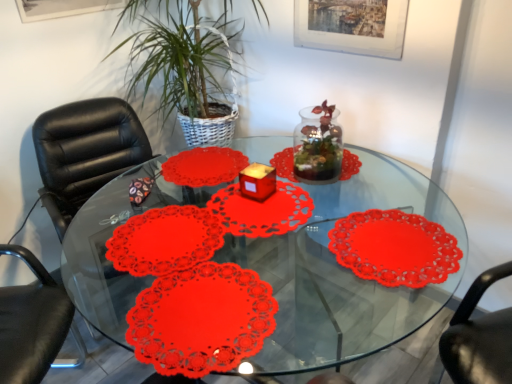
The width and height of the screenshot is (512, 384). What do you see at coordinates (257, 181) in the screenshot? I see `matte red candle holder at center` at bounding box center [257, 181].

Image resolution: width=512 pixels, height=384 pixels. What do you see at coordinates (352, 26) in the screenshot? I see `metallic silver picture frame at upper center` at bounding box center [352, 26].

At what (x,y) coordinates should I click in order to perform the action: click on metallic silver picture frame at upper center. Please return your answer as a coordinate pair (x, y). Looking at the image, I should click on (352, 26).

At what (x,y) coordinates should I click in order to perform the action: click on transparent plastic placemats at center. Please return your answer as a coordinate pair (x, y). Looking at the image, I should click on (344, 272).

In order to face black leather chair at left, should I rotate leftwards or rightwards?

Turn left by 17.905 degrees to look at black leather chair at left.

What do you see at coordinates (85, 152) in the screenshot? I see `black leather chair at left` at bounding box center [85, 152].

I want to click on matte red candle holder at center, so click(x=257, y=181).

Is transparent plastic placemats at center not within black leather chair at left?

transparent plastic placemats at center lies outside black leather chair at left's area.

Is transparent plastic placemats at center to the right of black leather chair at left from the viewer's perspective?

Correct, you'll find transparent plastic placemats at center to the right of black leather chair at left.

In terms of height, does transparent plastic placemats at center look taller or shorter compared to black leather chair at left?

transparent plastic placemats at center is shorter than black leather chair at left.

Find the location of a particular element. This screenshot has height=384, width=512. chair above the transparent plastic placemats at center (from a real-world perspective) is located at coordinates (85, 152).

Would you say matte paper doily at center is to the left or to the right of matte red candle holder at center in the picture?

Clearly, matte paper doily at center is on the left of matte red candle holder at center in the image.

From a real-world perspective, is matte paper doily at center above or below matte red candle holder at center?

matte paper doily at center is below matte red candle holder at center.

From the picture: From the image's perspective, is matte paper doily at center on matte red candle holder at center?

No, from the image's perspective, matte paper doily at center is not over matte red candle holder at center.

Is matte paper doily at center aimed at matte red candle holder at center?

No, matte paper doily at center is not facing towards matte red candle holder at center.

What's the angular difference between matte red candle holder at center and transparent glass jar at center's facing directions?

matte red candle holder at center and transparent glass jar at center are facing 0.00212 degrees away from each other.

Are matte red candle holder at center and transparent glass jar at center beside each other?

No, matte red candle holder at center is not touching transparent glass jar at center.

Considering the sizes of objects matte red candle holder at center and transparent glass jar at center in the image provided, who is taller, matte red candle holder at center or transparent glass jar at center?

Standing taller between the two is transparent glass jar at center.

Considering the relative sizes of matte red candle holder at center and transparent glass jar at center in the image provided, is matte red candle holder at center smaller than transparent glass jar at center?

Yes, matte red candle holder at center is smaller than transparent glass jar at center.

From the image's perspective, between transparent plastic placemats at center and matte red candle holder at center, which one is located above?

matte red candle holder at center is shown above in the image.

Which object is thinner, transparent plastic placemats at center or matte red candle holder at center?

Thinner between the two is matte red candle holder at center.

Is transparent plastic placemats at center with matte red candle holder at center?

transparent plastic placemats at center and matte red candle holder at center are clearly separated.

Does transparent plastic placemats at center turn towards matte red candle holder at center?

No, transparent plastic placemats at center is not turned towards matte red candle holder at center.

Between matte red candle holder at center and metallic silver picture frame at upper center, which one has larger size?

With larger size is metallic silver picture frame at upper center.

From the picture: Could you tell me if matte red candle holder at center is facing metallic silver picture frame at upper center?

No.

From the image's perspective, is matte red candle holder at center over metallic silver picture frame at upper center?

No, from the image's perspective, matte red candle holder at center is not on top of metallic silver picture frame at upper center.

From the image's perspective, is matte paper doily at center over black leather chair at left?

No, from the image's perspective, matte paper doily at center is not above black leather chair at left.

Would you say matte paper doily at center is inside or outside black leather chair at left?

matte paper doily at center is outside black leather chair at left.

How much distance is there between matte paper doily at center and black leather chair at left?

matte paper doily at center is 3.37 feet from black leather chair at left.

Considering the sizes of objects matte paper doily at center and black leather chair at left in the image provided, who is smaller, matte paper doily at center or black leather chair at left?

Smaller between the two is matte paper doily at center.

Considering the sizes of objects green leafy plant at center and metallic silver picture frame at upper center in the image provided, who is bigger, green leafy plant at center or metallic silver picture frame at upper center?

Bigger between the two is green leafy plant at center.

Between point (149, 21) and point (385, 18), which one is positioned behind?

The point (149, 21) is farther from the camera.

Can you confirm if green leafy plant at center is taller than metallic silver picture frame at upper center?

Yes, green leafy plant at center is taller than metallic silver picture frame at upper center.

How different are the orientations of green leafy plant at center and metallic silver picture frame at upper center in degrees?

They differ by 88.4 degrees in their facing directions.

You are a GUI agent. You are given a task and a screenshot of the screen. Output one action in this format:
    pyautogui.click(x=<x>, y=<y>)
    Task: Click on the table below the black leather chair at left (from the image's perspective)
    This screenshot has height=384, width=512.
    Given the screenshot: What is the action you would take?
    pyautogui.click(x=344, y=272)

Identify the location of candle holder that appears behind the matte paper doily at center. The image size is (512, 384). (257, 181).

Based on their spatial positions, is matte red candle holder at center or transparent glass jar at center further from matte paper doily at center?

transparent glass jar at center lies further to matte paper doily at center than the other object.

When comparing their distances from metallic silver picture frame at upper center, does matte red candle holder at center or transparent plastic placemats at center seem further?

The object further to metallic silver picture frame at upper center is transparent plastic placemats at center.

When comparing their distances from black leather chair at left, does metallic silver picture frame at upper center or transparent glass jar at center seem closer?

Based on the image, transparent glass jar at center appears to be nearer to black leather chair at left.

Which object lies further to the anchor point green leafy plant at center, matte paper doily at center or metallic silver picture frame at upper center?

matte paper doily at center is positioned further to the anchor green leafy plant at center.

Looking at the image, which one is located further to transparent plastic placemats at center, transparent glass jar at center or black leather chair at left?

Among the two, black leather chair at left is located further to transparent plastic placemats at center.

Looking at the image, which one is located further to metallic silver picture frame at upper center, green leafy plant at center or transparent glass jar at center?

green leafy plant at center is further to metallic silver picture frame at upper center.

From the image, which object appears to be farther from metallic silver picture frame at upper center, matte red candle holder at center or black leather chair at left?

black leather chair at left.

Considering their positions, is black leather chair at left positioned further to metallic silver picture frame at upper center than green leafy plant at center?

Based on the image, black leather chair at left appears to be further to metallic silver picture frame at upper center.

Where is `flower between green leafy plant at center and transparent plastic placemats at center in the vertical direction`? flower between green leafy plant at center and transparent plastic placemats at center in the vertical direction is located at coordinates (201, 319).

The height and width of the screenshot is (384, 512). Find the location of `glass vase between matte paper doily at center and matte red candle holder at center from front to back`. glass vase between matte paper doily at center and matte red candle holder at center from front to back is located at coordinates coord(318,145).

At what (x,y) coordinates should I click in order to perform the action: click on candle holder between black leather chair at left and transparent glass jar at center in the horizontal direction. Please return your answer as a coordinate pair (x, y). The image size is (512, 384). Looking at the image, I should click on (257, 181).

This screenshot has height=384, width=512. I want to click on glass vase between metallic silver picture frame at upper center and transparent plastic placemats at center vertically, so click(318, 145).